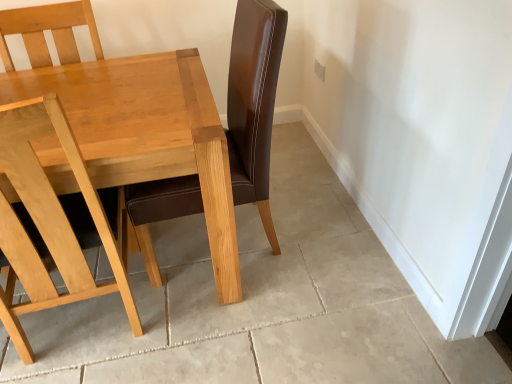
This screenshot has width=512, height=384. Find the location of `empty space that is in between light wood chair at left and light wood table at center`. empty space that is in between light wood chair at left and light wood table at center is located at coordinates (148, 337).